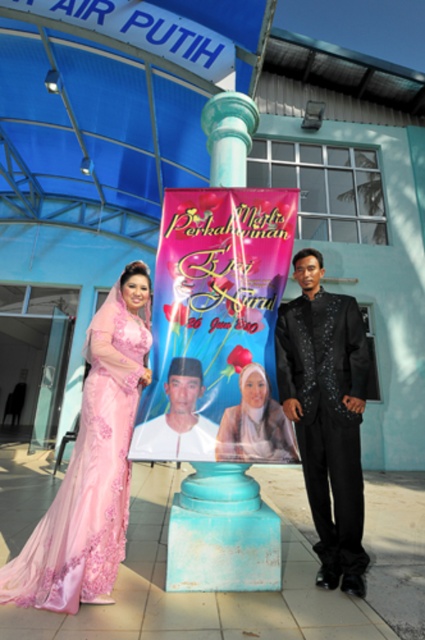
Is pink satin banner at center below pink satin dress at left?

No.

Between pink satin banner at center and pink satin dress at left, which one has more height?

pink satin dress at left

Locate an element on the screen. This screenshot has width=425, height=640. pink satin banner at center is located at coordinates (218, 326).

What are the coordinates of `pink satin banner at center` in the screenshot? It's located at (218, 326).

Can you confirm if pink satin banner at center is positioned to the right of black satin suit at center?

In fact, pink satin banner at center is to the left of black satin suit at center.

The height and width of the screenshot is (640, 425). Describe the element at coordinates (218, 326) in the screenshot. I see `pink satin banner at center` at that location.

Find the location of `pink satin banner at center`. pink satin banner at center is located at coordinates (218, 326).

Where is `pink satin banner at center`? This screenshot has height=640, width=425. pink satin banner at center is located at coordinates (218, 326).

Is pink satin banner at center below matte pink hijab at center?

Actually, pink satin banner at center is above matte pink hijab at center.

Can you confirm if pink satin banner at center is taller than matte pink hijab at center?

Yes, pink satin banner at center is taller than matte pink hijab at center.

Locate an element on the screen. pink satin banner at center is located at coordinates (218, 326).

Where is `pink satin banner at center`? Image resolution: width=425 pixels, height=640 pixels. pink satin banner at center is located at coordinates (218, 326).